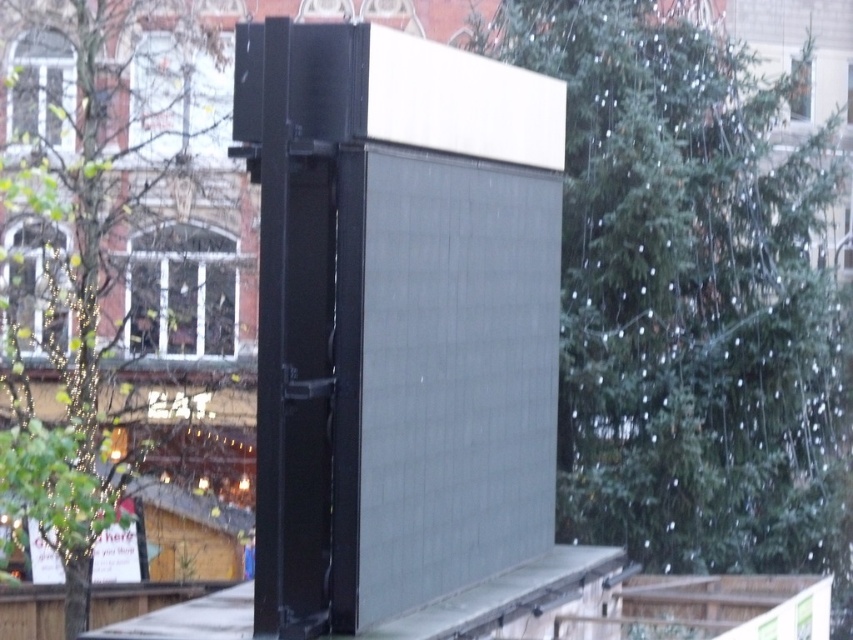
Between green textured tree at center and green leafy tree at left, which one is positioned higher?

green textured tree at center

Does point (701, 346) come behind point (163, 216)?

No, (701, 346) is in front of (163, 216).

The width and height of the screenshot is (853, 640). I want to click on green textured tree at center, so click(x=689, y=296).